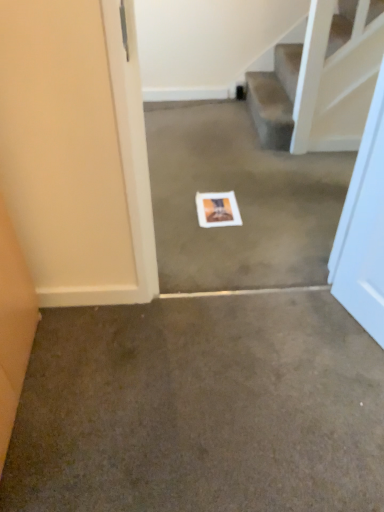
Question: Is white matte postcard at center completely or partially outside of brown carpet at center, arranged as the 2th concrete when viewed from the back?

Choices:
 (A) no
 (B) yes

Answer: (B)

Question: Is white matte postcard at center closer to camera compared to brown carpet at center, placed as the second concrete when sorted from top to bottom?

Choices:
 (A) no
 (B) yes

Answer: (A)

Question: From a real-world perspective, does white matte postcard at center stand above brown carpet at center, arranged as the 2th concrete when viewed from the back?

Choices:
 (A) no
 (B) yes

Answer: (B)

Question: Are white matte postcard at center and brown carpet at center, the 1th concrete viewed from the front, far apart?

Choices:
 (A) no
 (B) yes

Answer: (A)

Question: From a real-world perspective, is white matte postcard at center located beneath brown carpet at center, the 1th concrete from the bottom?

Choices:
 (A) no
 (B) yes

Answer: (A)

Question: Considering the positions of white paper at center, positioned as the first concrete in back-to-front order, and brown carpet at center, the 1th concrete from the bottom, in the image, is white paper at center, positioned as the first concrete in back-to-front order, wider or thinner than brown carpet at center, the 1th concrete from the bottom,?

Choices:
 (A) wide
 (B) thin

Answer: (A)

Question: Is white paper at center, the 2th concrete ordered from the bottom, inside the boundaries of brown carpet at center, placed as the second concrete when sorted from top to bottom, or outside?

Choices:
 (A) outside
 (B) inside

Answer: (A)

Question: Considering the positions of white paper at center, the 2th concrete ordered from the bottom, and brown carpet at center, arranged as the 2th concrete when viewed from the back, in the image, is white paper at center, the 2th concrete ordered from the bottom, taller or shorter than brown carpet at center, arranged as the 2th concrete when viewed from the back,?

Choices:
 (A) tall
 (B) short

Answer: (A)

Question: Based on their positions, is white paper at center, the second concrete when ordered from front to back, located to the left or right of brown carpet at center, placed as the second concrete when sorted from top to bottom?

Choices:
 (A) right
 (B) left

Answer: (A)

Question: Considering the positions of brown carpet at center, placed as the second concrete when sorted from top to bottom, and white matte postcard at center in the image, is brown carpet at center, placed as the second concrete when sorted from top to bottom, wider or thinner than white matte postcard at center?

Choices:
 (A) wide
 (B) thin

Answer: (A)

Question: From the image's perspective, relative to white matte postcard at center, is brown carpet at center, arranged as the 2th concrete when viewed from the back, above or below?

Choices:
 (A) above
 (B) below

Answer: (B)

Question: From a real-world perspective, is brown carpet at center, the 1th concrete from the bottom, physically located above or below white matte postcard at center?

Choices:
 (A) above
 (B) below

Answer: (B)

Question: Is brown carpet at center, the 1th concrete viewed from the front, bigger or smaller than white matte postcard at center?

Choices:
 (A) small
 (B) big

Answer: (B)

Question: Is brown carpet at center, the 1th concrete viewed from the front, taller or shorter than white paper at center, the second concrete when ordered from front to back?

Choices:
 (A) tall
 (B) short

Answer: (B)

Question: Considering the relative positions of brown carpet at center, the 1th concrete viewed from the front, and white paper at center, which is the first concrete in top-to-bottom order, in the image provided, is brown carpet at center, the 1th concrete viewed from the front, to the left or to the right of white paper at center, which is the first concrete in top-to-bottom order,?

Choices:
 (A) right
 (B) left

Answer: (B)